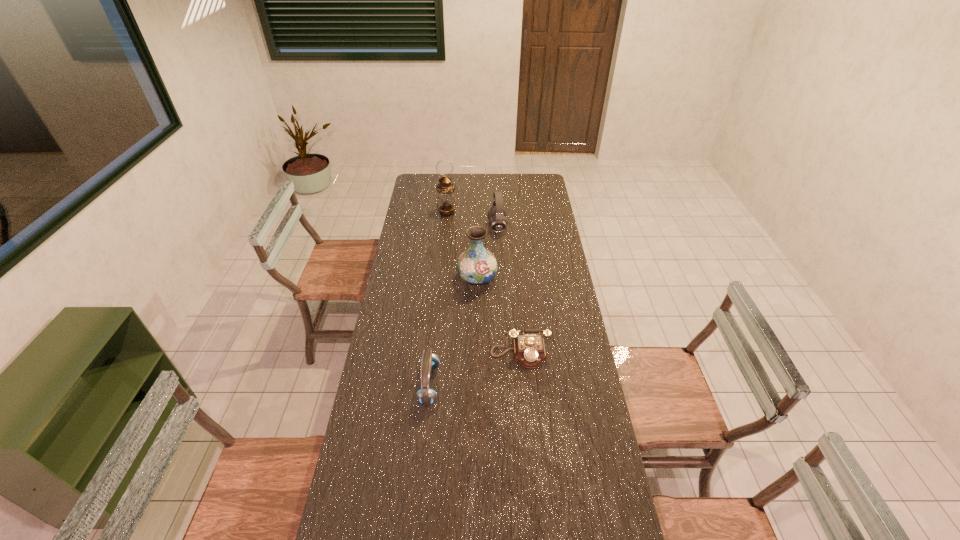
Identify the location of the tallest object. (446, 203).

Where is `oil lamp`? This screenshot has width=960, height=540. oil lamp is located at coordinates (446, 203).

Locate an element on the screen. This screenshot has height=540, width=960. vase is located at coordinates (477, 265).

This screenshot has width=960, height=540. In order to click on the third farthest object in this screenshot , I will do `click(477, 265)`.

Locate an element on the screen. The height and width of the screenshot is (540, 960). the third shortest object is located at coordinates (498, 222).

You are a GUI agent. You are given a task and a screenshot of the screen. Output one action in this format:
    pyautogui.click(x=<x>, y=<y>)
    Task: Click on the taller headset
    The width and height of the screenshot is (960, 540).
    Given the screenshot: What is the action you would take?
    tap(498, 222)

Locate an element on the screen. Image resolution: width=960 pixels, height=540 pixels. the shorter headset is located at coordinates (426, 396).

The image size is (960, 540). Find the location of `the left headset`. the left headset is located at coordinates (426, 396).

What are the coordinates of `telephone` in the screenshot? It's located at (529, 350).

This screenshot has height=540, width=960. I want to click on free location located 0.240m on the front of the oil lamp, so click(444, 245).